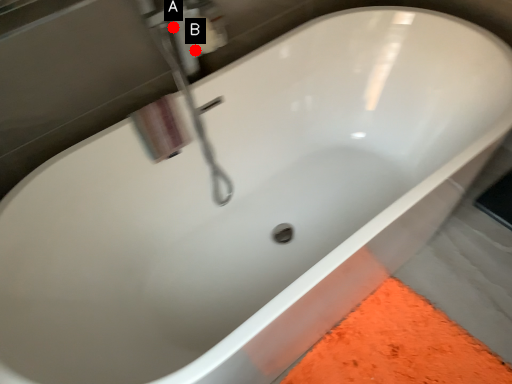
Question: Two points are circled on the image, labeled by A and B beside each circle. Among these points, which one is nearest to the camera?

Choices:
 (A) A is closer
 (B) B is closer

Answer: (A)